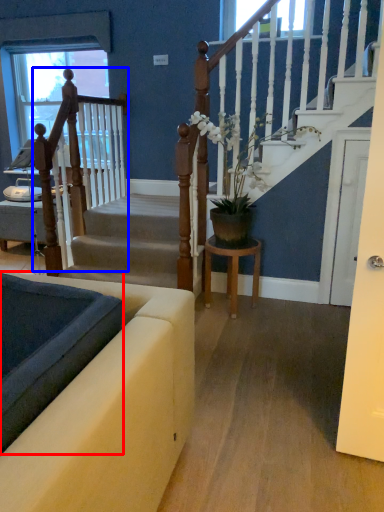
Question: Among these objects, which one is nearest to the camera, landing (highlighted by a red box) or rail (highlighted by a blue box)?

Choices:
 (A) landing
 (B) rail

Answer: (A)